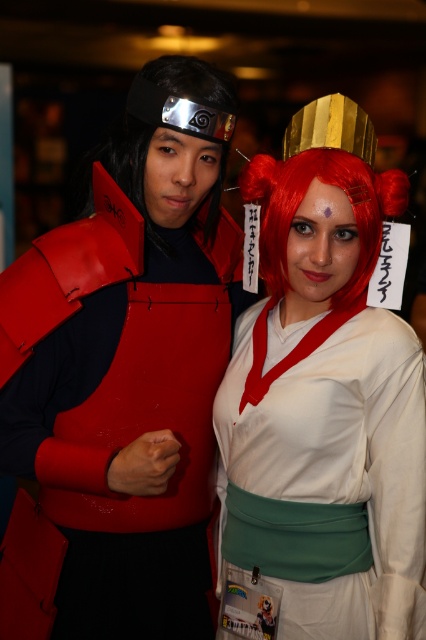
Can you confirm if shiny red wig at center is bigger than yellow paper comic book at lower center?

Yes.

Which of these two, shiny red wig at center or yellow paper comic book at lower center, stands taller?

With more height is shiny red wig at center.

Image resolution: width=426 pixels, height=640 pixels. I want to click on shiny red wig at center, so click(x=302, y=198).

Is white matte kimono at center to the left of yellow paper comic book at lower center from the viewer's perspective?

Incorrect, white matte kimono at center is not on the left side of yellow paper comic book at lower center.

The height and width of the screenshot is (640, 426). Identify the location of white matte kimono at center. (325, 396).

The image size is (426, 640). Find the location of `white matte kimono at center`. white matte kimono at center is located at coordinates (325, 396).

Is white matte kimono at center thinner than shiny red wig at center?

No, white matte kimono at center is not thinner than shiny red wig at center.

Is white matte kimono at center to the left of shiny red wig at center from the viewer's perspective?

In fact, white matte kimono at center is to the right of shiny red wig at center.

Who is more distant from viewer, (301, 147) or (265, 230)?

Positioned behind is point (265, 230).

I want to click on white matte kimono at center, so pos(325,396).